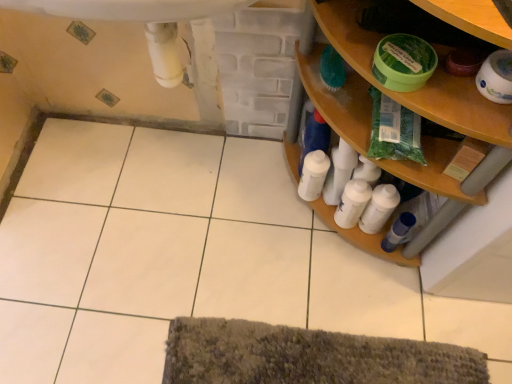
Question: From the image's perspective, is green plastic bag at upper right above or below white glossy toilet paper at upper right?

Choices:
 (A) below
 (B) above

Answer: (A)

Question: Visually, is green plastic bag at upper right positioned to the left or to the right of white glossy toilet paper at upper right?

Choices:
 (A) left
 (B) right

Answer: (A)

Question: Which object is the closest to the wooden shelf at right?

Choices:
 (A) white glossy toilet paper at upper right
 (B) green plastic bag at upper right
 (C) white glossy bottle at lower right, the first toiletry when ordered from left to right
 (D) white plastic sink at upper center
 (E) white glossy bottles at center right, which is the second toiletry in left-to-right order

Answer: (B)

Question: Which is farther from the white plastic sink at upper center?

Choices:
 (A) wooden shelf at right
 (B) blue glossy bottle at lower right, arranged as the 3th toiletry when viewed from the left
 (C) white glossy bottles at center right, which is the second toiletry in left-to-right order
 (D) green plastic bag at upper right
 (E) white glossy toilet paper at upper right

Answer: (B)